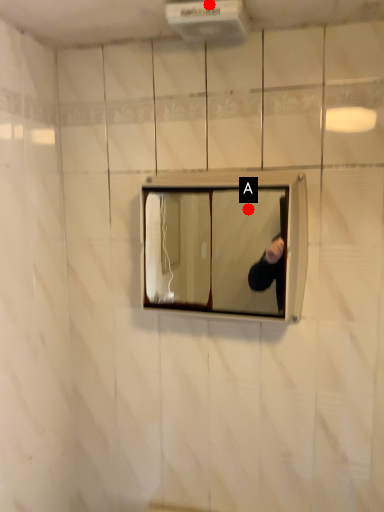
Question: Two points are circled on the image, labeled by A and B beside each circle. Which point appears farthest from the camera in this image?

Choices:
 (A) A is further
 (B) B is further

Answer: (A)